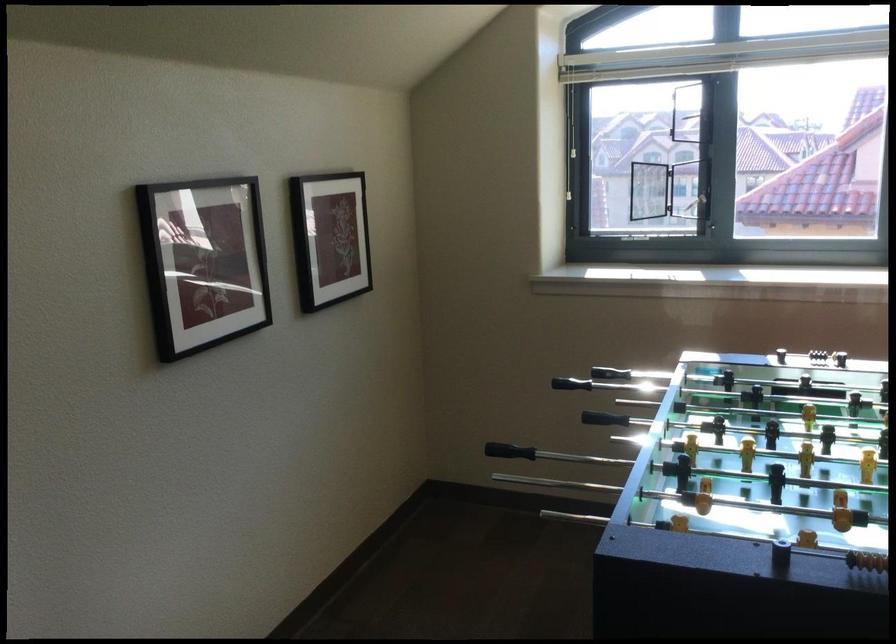
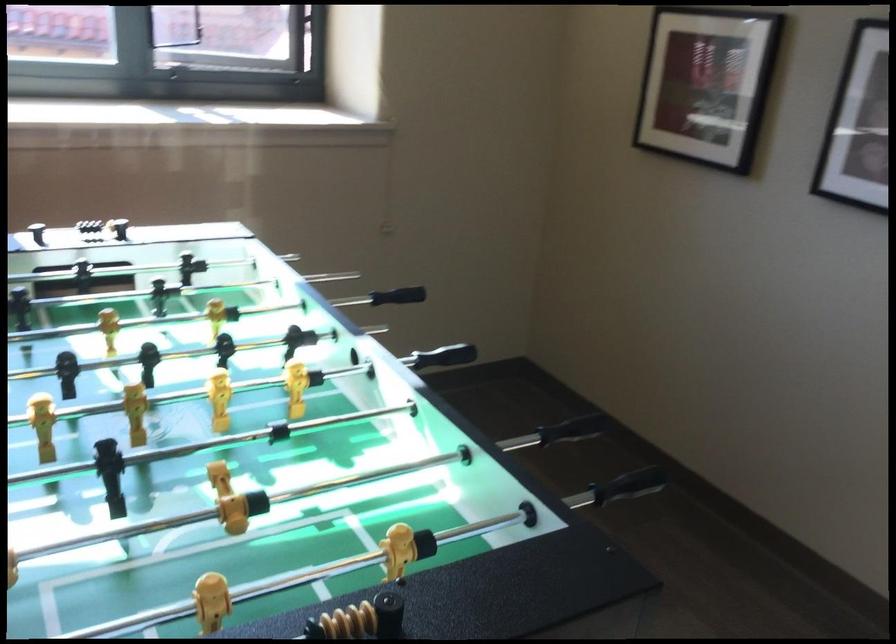
Question: The camera is either moving clockwise (left) or counter-clockwise (right) around the object. The first image is from the beginning of the video and the second image is from the end. Is the camera moving left or right when shooting the video?

Choices:
 (A) Left
 (B) Right

Answer: (A)